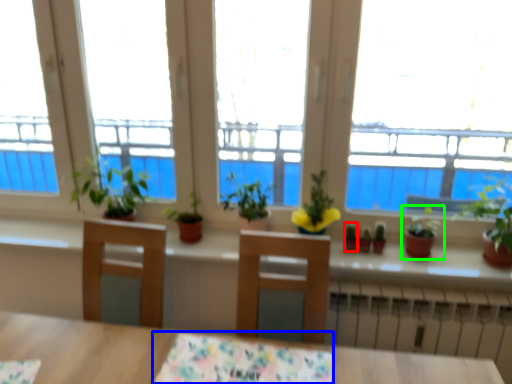
Question: Which object is positioned farthest from plant (highlighted by a red box)? Select from tablecloth (highlighted by a blue box) and houseplant (highlighted by a green box).

Choices:
 (A) tablecloth
 (B) houseplant

Answer: (A)